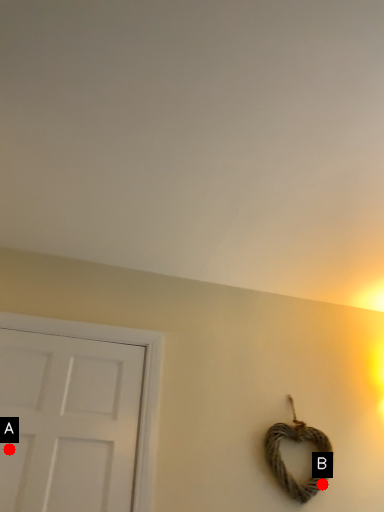
Question: Two points are circled on the image, labeled by A and B beside each circle. Which point is farther from the camera taking this photo?

Choices:
 (A) A is further
 (B) B is further

Answer: (B)